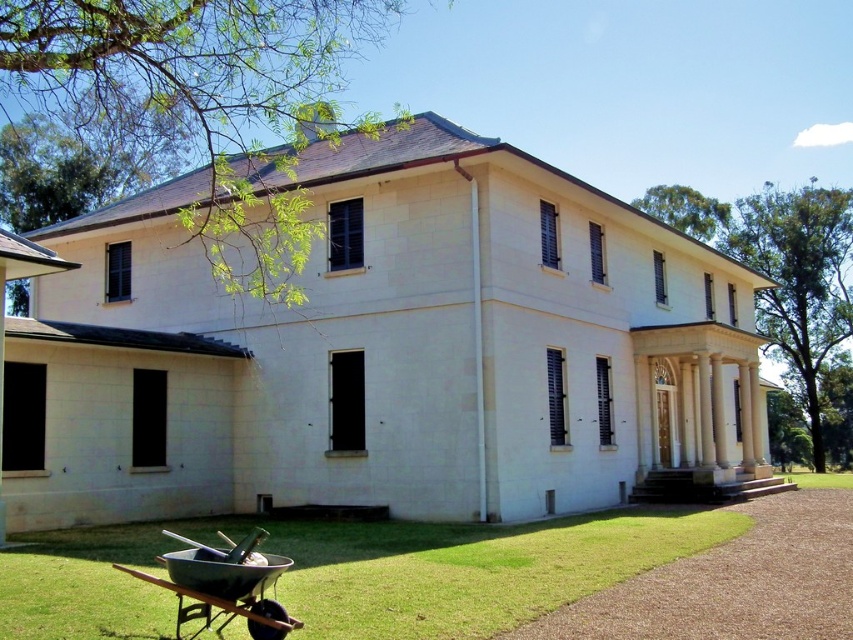
You are standing in front of the two story building and want to walk towards the entrance. There is green grass at lower left and metallic wheelbarrow at lower left in your way. Which one is wider so you can choose the best path?

The green grass at lower left is wider than the metallic wheelbarrow at lower left, so you should choose the path through the green grass at lower left.